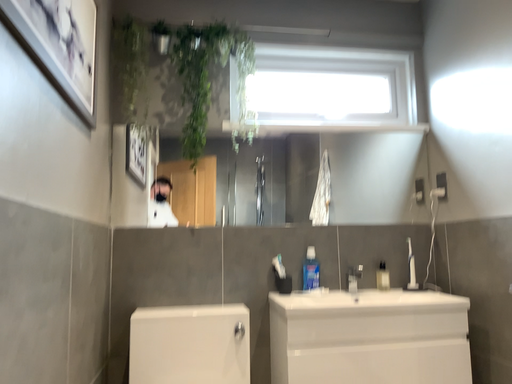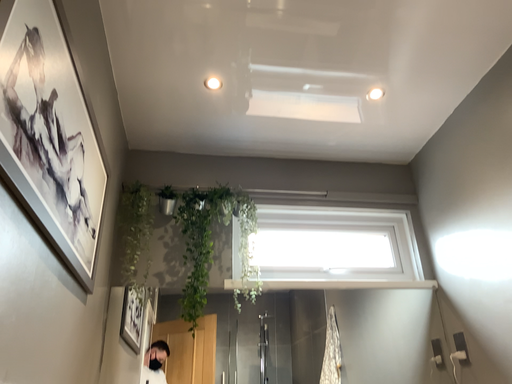
Question: Which way did the camera rotate in the video?

Choices:
 (A) rotated downward
 (B) rotated upward

Answer: (B)